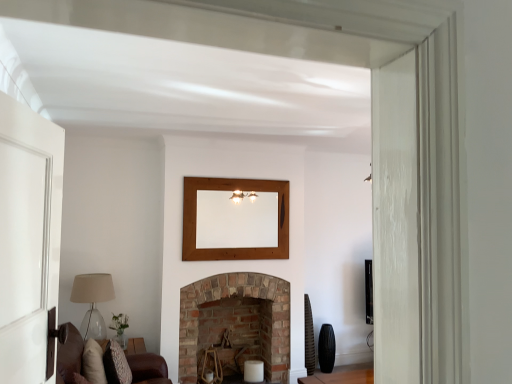
Question: Can you confirm if wooden mirror at upper center is bigger than brown leather couch at lower left?

Choices:
 (A) yes
 (B) no

Answer: (B)

Question: Are wooden mirror at upper center and brown leather couch at lower left far apart?

Choices:
 (A) yes
 (B) no

Answer: (A)

Question: From a real-world perspective, does wooden mirror at upper center stand above brown leather couch at lower left?

Choices:
 (A) yes
 (B) no

Answer: (A)

Question: Considering the relative positions of wooden mirror at upper center and brown leather couch at lower left in the image provided, is wooden mirror at upper center to the right of brown leather couch at lower left from the viewer's perspective?

Choices:
 (A) yes
 (B) no

Answer: (A)

Question: From a real-world perspective, is wooden mirror at upper center located beneath brown leather couch at lower left?

Choices:
 (A) no
 (B) yes

Answer: (A)

Question: From the image's perspective, is wooden mirror at upper center beneath brown leather couch at lower left?

Choices:
 (A) yes
 (B) no

Answer: (B)

Question: Is wooden mirror at upper center wider than brick fireplace at center?

Choices:
 (A) yes
 (B) no

Answer: (B)

Question: Is wooden mirror at upper center bigger than brick fireplace at center?

Choices:
 (A) no
 (B) yes

Answer: (A)

Question: Is wooden mirror at upper center taller than brick fireplace at center?

Choices:
 (A) yes
 (B) no

Answer: (B)

Question: Does wooden mirror at upper center appear on the left side of brick fireplace at center?

Choices:
 (A) no
 (B) yes

Answer: (A)

Question: Is wooden mirror at upper center positioned with its back to brick fireplace at center?

Choices:
 (A) no
 (B) yes

Answer: (A)

Question: Considering the relative positions of wooden mirror at upper center and brick fireplace at center in the image provided, is wooden mirror at upper center to the right of brick fireplace at center from the viewer's perspective?

Choices:
 (A) yes
 (B) no

Answer: (A)

Question: Does translucent glass lampshade at left have a larger size compared to brown leather couch at lower left?

Choices:
 (A) yes
 (B) no

Answer: (B)